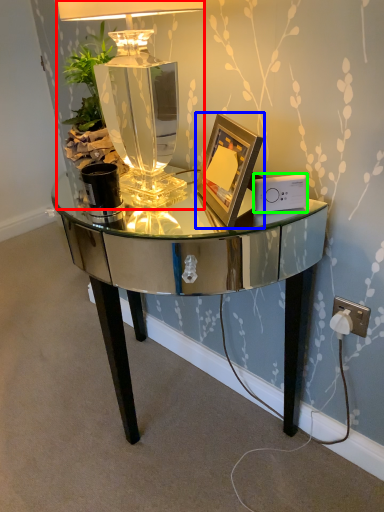
Question: Which is farther away from lamp (highlighted by a red box)? picture frame (highlighted by a blue box) or ipod (highlighted by a green box)?

Choices:
 (A) picture frame
 (B) ipod

Answer: (B)